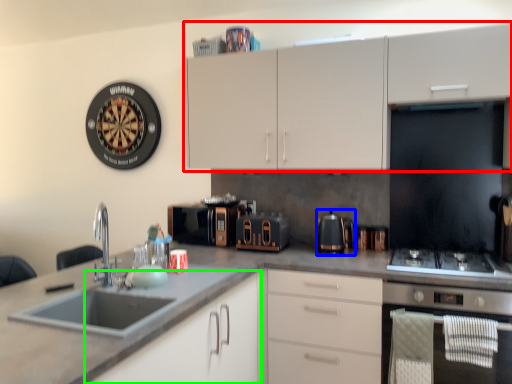
Question: Which object is the closest to the cabinetry (highlighted by a red box)? Choose among these: kitchen appliance (highlighted by a blue box) or cabinetry (highlighted by a green box).

Choices:
 (A) kitchen appliance
 (B) cabinetry

Answer: (A)